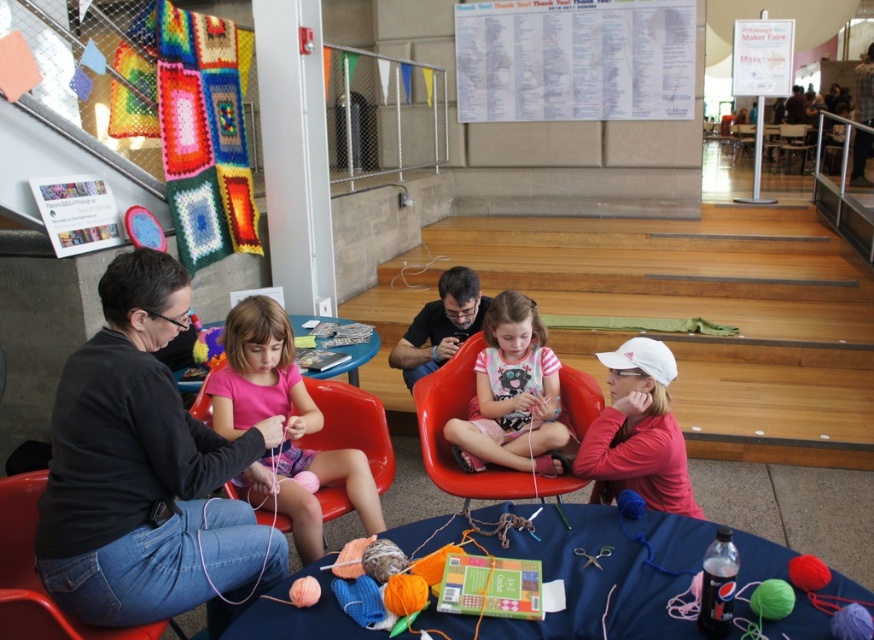
Question: Does white paper at upper center appear on the right side of matte plastic chair at center?

Choices:
 (A) yes
 (B) no

Answer: (A)

Question: Is pink fabric at center smaller than matte plastic chair at center?

Choices:
 (A) yes
 (B) no

Answer: (A)

Question: Which object is closer to the camera taking this photo?

Choices:
 (A) matte white cap at upper right
 (B) pink fabric dress at center
 (C) white paper at upper center
 (D) matte black sweater at left

Answer: (D)

Question: Which point is farther to the camera?

Choices:
 (A) matte plastic chair at lower left
 (B) pink fabric dress at center
 (C) matte white cap at upper right
 (D) white paper at upper center

Answer: (D)

Question: Which object appears farthest from the camera in this image?

Choices:
 (A) pink fabric at center
 (B) pink fabric dress at center
 (C) matte plastic chair at center

Answer: (B)

Question: Can you confirm if white paper at upper center is positioned below matte plastic chair at lower left?

Choices:
 (A) no
 (B) yes

Answer: (A)